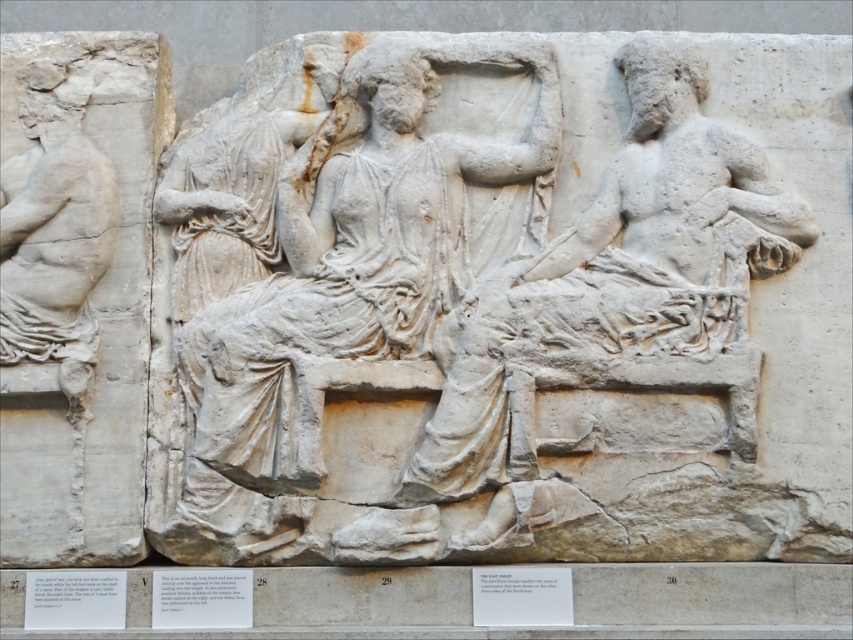
Question: Is white marble figure at center positioned behind white marble figure at left?

Choices:
 (A) no
 (B) yes

Answer: (B)

Question: Which point appears farthest from the camera in this image?

Choices:
 (A) (39, 330)
 (B) (643, 113)

Answer: (B)

Question: Estimate the real-world distances between objects in this image. Which object is closer to the white marble figure at left?

Choices:
 (A) white marble figure at center
 (B) white stone figure at center

Answer: (A)

Question: Estimate the real-world distances between objects in this image. Which object is farther from the white stone figure at center?

Choices:
 (A) white marble figure at center
 (B) white marble figure at left

Answer: (B)

Question: Is white stone figure at center thinner than white marble figure at left?

Choices:
 (A) no
 (B) yes

Answer: (B)

Question: Can you confirm if white stone figure at center is positioned to the right of white marble figure at left?

Choices:
 (A) yes
 (B) no

Answer: (A)